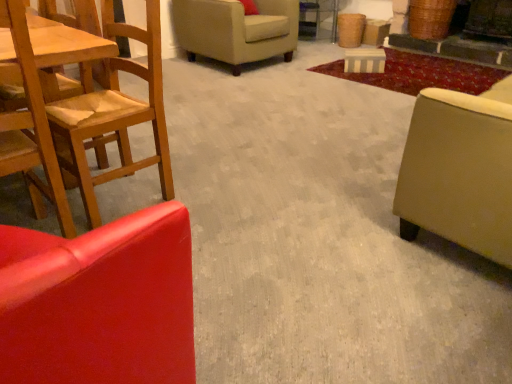
In order to face wooden chair at left, the second chair positioned from the front, should I rotate leftwards or rightwards?

Turn left approximately 19.840 degrees to face it.

Measure the distance between point (129, 107) and camera.

The distance of point (129, 107) from camera is 1.71 meters.

This screenshot has height=384, width=512. Describe the element at coordinates (236, 30) in the screenshot. I see `beige fabric armchair at upper center, which appears as the 1th chair when viewed from the back` at that location.

The width and height of the screenshot is (512, 384). What do you see at coordinates (30, 127) in the screenshot?
I see `wooden chair at left, marked as the 1th chair in a front-to-back arrangement` at bounding box center [30, 127].

Where is `wooden chair at left, marked as the 1th chair in a front-to-back arrangement`? This screenshot has height=384, width=512. wooden chair at left, marked as the 1th chair in a front-to-back arrangement is located at coordinates (30, 127).

You are a GUI agent. You are given a task and a screenshot of the screen. Output one action in this format:
    pyautogui.click(x=<x>, y=<y>)
    Task: Click on the wooden chair at left, the second chair positioned from the front
    Image resolution: width=512 pixels, height=384 pixels.
    Given the screenshot: What is the action you would take?
    pyautogui.click(x=115, y=114)

Is beige fabric armchair at upper center, the third chair viewed from the front, next to wooden chair at left, marked as the 1th chair in a front-to-back arrangement, and touching it?

No, beige fabric armchair at upper center, the third chair viewed from the front, is not with wooden chair at left, marked as the 1th chair in a front-to-back arrangement.

From a real-world perspective, between beige fabric armchair at upper center, which appears as the 1th chair when viewed from the back, and wooden chair at left, marked as the 1th chair in a front-to-back arrangement, who is vertically lower?

In real-world perspective, beige fabric armchair at upper center, which appears as the 1th chair when viewed from the back, is lower.

I want to click on the 2nd chair positioned below the beige fabric armchair at upper center, which appears as the 1th chair when viewed from the back (from the image's perspective), so click(30, 127).

Considering the relative sizes of beige fabric armchair at upper center, the third chair viewed from the front, and wooden chair at left, marked as the 1th chair in a front-to-back arrangement, in the image provided, is beige fabric armchair at upper center, the third chair viewed from the front, smaller than wooden chair at left, marked as the 1th chair in a front-to-back arrangement,?

Incorrect, beige fabric armchair at upper center, the third chair viewed from the front, is not smaller in size than wooden chair at left, marked as the 1th chair in a front-to-back arrangement.

Can you confirm if beige fabric studio couch at right is positioned to the right of wooden chair at left, the third chair positioned from the back?

Yes, beige fabric studio couch at right is to the right of wooden chair at left, the third chair positioned from the back.

From the image's perspective, would you say beige fabric studio couch at right is positioned over wooden chair at left, the third chair positioned from the back?

Yes, from the image's perspective, beige fabric studio couch at right is on top of wooden chair at left, the third chair positioned from the back.

Does beige fabric studio couch at right turn towards wooden chair at left, marked as the 1th chair in a front-to-back arrangement?

No, beige fabric studio couch at right is not oriented towards wooden chair at left, marked as the 1th chair in a front-to-back arrangement.

How different are the orientations of wooden chair at left, the 2th chair positioned from the back, and beige fabric armchair at upper center, the third chair viewed from the front, in degrees?

They differ by 87.4 degrees in their facing directions.

Is wooden chair at left, the 2th chair positioned from the back, in front of or behind beige fabric armchair at upper center, the third chair viewed from the front, in the image?

Clearly, wooden chair at left, the 2th chair positioned from the back, is in front of beige fabric armchair at upper center, the third chair viewed from the front.

In terms of width, does wooden chair at left, the second chair positioned from the front, look wider or thinner when compared to beige fabric armchair at upper center, which appears as the 1th chair when viewed from the back?

wooden chair at left, the second chair positioned from the front, is thinner than beige fabric armchair at upper center, which appears as the 1th chair when viewed from the back.

Where is `the 1st chair in front of the beige fabric armchair at upper center, which appears as the 1th chair when viewed from the back`? This screenshot has height=384, width=512. the 1st chair in front of the beige fabric armchair at upper center, which appears as the 1th chair when viewed from the back is located at coordinates (115, 114).

Is beige fabric armchair at upper center, which appears as the 1th chair when viewed from the back, positioned beyond the bounds of wooden chair at left, the 2th chair positioned from the back?

Yes, beige fabric armchair at upper center, which appears as the 1th chair when viewed from the back, is not within wooden chair at left, the 2th chair positioned from the back.

Based on the photo, who is smaller, beige fabric armchair at upper center, which appears as the 1th chair when viewed from the back, or wooden chair at left, the 2th chair positioned from the back?

wooden chair at left, the 2th chair positioned from the back.

Between beige fabric armchair at upper center, the third chair viewed from the front, and wooden chair at left, the 2th chair positioned from the back, which one is positioned in front?

wooden chair at left, the 2th chair positioned from the back, is in front.

What's the angular difference between beige fabric armchair at upper center, the third chair viewed from the front, and wooden chair at left, the 2th chair positioned from the back,'s facing directions?

beige fabric armchair at upper center, the third chair viewed from the front, and wooden chair at left, the 2th chair positioned from the back, are facing 87.4 degrees away from each other.

Choose the correct answer: Is wooden chair at left, marked as the 1th chair in a front-to-back arrangement, inside wooden chair at left, the second chair positioned from the front, or outside it?

The correct answer is: outside.

Does wooden chair at left, the third chair positioned from the back, touch wooden chair at left, the 2th chair positioned from the back?

No, wooden chair at left, the third chair positioned from the back, is not with wooden chair at left, the 2th chair positioned from the back.

Is wooden chair at left, the third chair positioned from the back, oriented away from wooden chair at left, the second chair positioned from the front?

wooden chair at left, the third chair positioned from the back, does not have its back to wooden chair at left, the second chair positioned from the front.

Is beige fabric studio couch at right aimed at beige fabric armchair at upper center, the third chair viewed from the front?

Yes.

Is beige fabric studio couch at right taller or shorter than beige fabric armchair at upper center, which appears as the 1th chair when viewed from the back?

beige fabric studio couch at right is taller than beige fabric armchair at upper center, which appears as the 1th chair when viewed from the back.

Which point is more distant from viewer, (503, 99) or (190, 41)?

The point (190, 41) is behind.

Is beige fabric studio couch at right to the left of beige fabric armchair at upper center, which appears as the 1th chair when viewed from the back, from the viewer's perspective?

Incorrect, beige fabric studio couch at right is not on the left side of beige fabric armchair at upper center, which appears as the 1th chair when viewed from the back.

From a real-world perspective, does wooden chair at left, the third chair positioned from the back, stand above beige fabric studio couch at right?

Yes.

Can you confirm if wooden chair at left, the third chair positioned from the back, is wider than beige fabric studio couch at right?

No, wooden chair at left, the third chair positioned from the back, is not wider than beige fabric studio couch at right.

From the image's perspective, is wooden chair at left, marked as the 1th chair in a front-to-back arrangement, above or below beige fabric studio couch at right?

From the image's perspective, wooden chair at left, marked as the 1th chair in a front-to-back arrangement, appears below beige fabric studio couch at right.

Is wooden chair at left, the third chair positioned from the back, far away from beige fabric studio couch at right?

Yes, wooden chair at left, the third chair positioned from the back, and beige fabric studio couch at right are located far from each other.

From a real-world perspective, count 2nd chairs downward from the wooden chair at left, marked as the 1th chair in a front-to-back arrangement, and point to it. Please provide its 2D coordinates.

[(236, 30)]

Locate an element on the screen. This screenshot has width=512, height=384. the 2nd chair below the beige fabric studio couch at right (from the image's perspective) is located at coordinates (30, 127).

Looking at the image, which one is located further to wooden chair at left, marked as the 1th chair in a front-to-back arrangement, wooden chair at left, the 2th chair positioned from the back, or beige fabric armchair at upper center, the third chair viewed from the front?

Among the two, beige fabric armchair at upper center, the third chair viewed from the front, is located further to wooden chair at left, marked as the 1th chair in a front-to-back arrangement.

Looking at the image, which one is located further to wooden chair at left, the 2th chair positioned from the back, beige fabric armchair at upper center, which appears as the 1th chair when viewed from the back, or beige fabric studio couch at right?

beige fabric armchair at upper center, which appears as the 1th chair when viewed from the back, is further to wooden chair at left, the 2th chair positioned from the back.

From the image, which object appears to be nearer to wooden chair at left, the second chair positioned from the front, beige fabric studio couch at right or beige fabric armchair at upper center, which appears as the 1th chair when viewed from the back?

beige fabric studio couch at right lies closer to wooden chair at left, the second chair positioned from the front, than the other object.

Looking at the image, which one is located closer to wooden chair at left, the second chair positioned from the front, wooden chair at left, marked as the 1th chair in a front-to-back arrangement, or beige fabric studio couch at right?

Based on the image, wooden chair at left, marked as the 1th chair in a front-to-back arrangement, appears to be nearer to wooden chair at left, the second chair positioned from the front.

Considering their positions, is wooden chair at left, the second chair positioned from the front, positioned further to beige fabric studio couch at right than wooden chair at left, marked as the 1th chair in a front-to-back arrangement?

Based on the image, wooden chair at left, marked as the 1th chair in a front-to-back arrangement, appears to be further to beige fabric studio couch at right.

When comparing their distances from beige fabric studio couch at right, does wooden chair at left, marked as the 1th chair in a front-to-back arrangement, or wooden chair at left, the 2th chair positioned from the back, seem further?

Based on the image, wooden chair at left, marked as the 1th chair in a front-to-back arrangement, appears to be further to beige fabric studio couch at right.

Based on their spatial positions, is beige fabric studio couch at right or wooden chair at left, the second chair positioned from the front, closer to wooden chair at left, the third chair positioned from the back?

Among the two, wooden chair at left, the second chair positioned from the front, is located nearer to wooden chair at left, the third chair positioned from the back.

From the image, which object appears to be nearer to wooden chair at left, marked as the 1th chair in a front-to-back arrangement, beige fabric studio couch at right or beige fabric armchair at upper center, the third chair viewed from the front?

Among the two, beige fabric studio couch at right is located nearer to wooden chair at left, marked as the 1th chair in a front-to-back arrangement.

You are a GUI agent. You are given a task and a screenshot of the screen. Output one action in this format:
    pyautogui.click(x=<x>, y=<y>)
    Task: Click on the chair located between beige fabric studio couch at right and beige fabric armchair at upper center, the third chair viewed from the front, in the depth direction
    
    Given the screenshot: What is the action you would take?
    115,114

This screenshot has height=384, width=512. In order to click on chair between wooden chair at left, the third chair positioned from the back, and beige fabric armchair at upper center, which appears as the 1th chair when viewed from the back, from front to back in this screenshot , I will do `click(115, 114)`.

In order to click on studio couch between wooden chair at left, marked as the 1th chair in a front-to-back arrangement, and beige fabric armchair at upper center, the third chair viewed from the front, along the z-axis in this screenshot , I will do `click(460, 170)`.